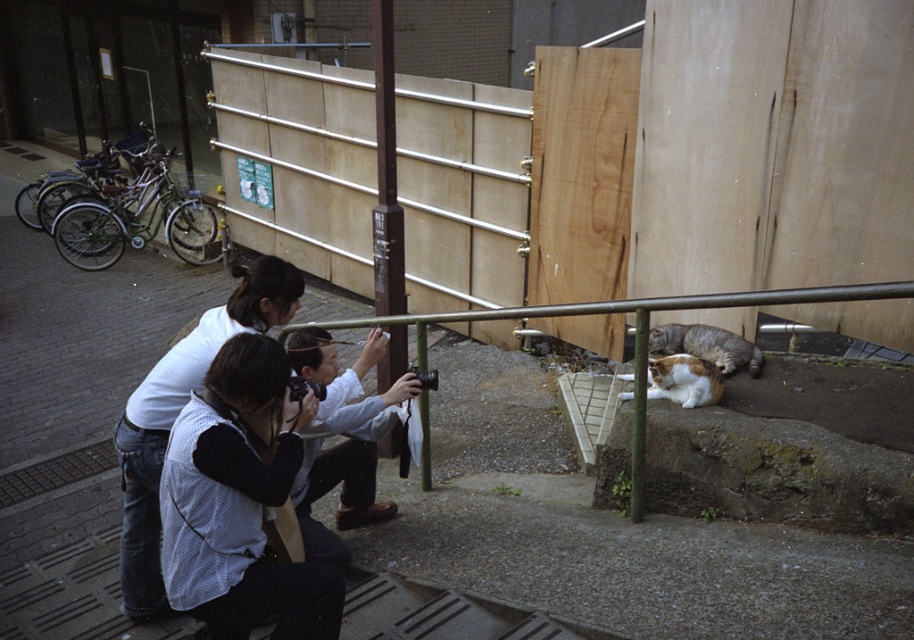
Question: Which object is the closest to the orange and white fur cat at lower right?

Choices:
 (A) white shirt at lower left
 (B) gray tabby cat at lower right
 (C) white cotton shirt at center

Answer: (B)

Question: Where is white shirt at lower left located in relation to white cotton shirt at center in the image?

Choices:
 (A) below
 (B) above

Answer: (B)

Question: Can you confirm if white shirt at lower left is thinner than gray tabby cat at lower right?

Choices:
 (A) yes
 (B) no

Answer: (B)

Question: Is white cotton shirt at center further to the viewer compared to gray tabby cat at lower right?

Choices:
 (A) no
 (B) yes

Answer: (A)

Question: Estimate the real-world distances between objects in this image. Which object is farther from the orange and white fur cat at lower right?

Choices:
 (A) gray tabby cat at lower right
 (B) white cotton shirt at center
 (C) white shirt at lower left

Answer: (C)

Question: Which of the following is the closest to the observer?

Choices:
 (A) white shirt at lower left
 (B) gray tabby cat at lower right

Answer: (A)